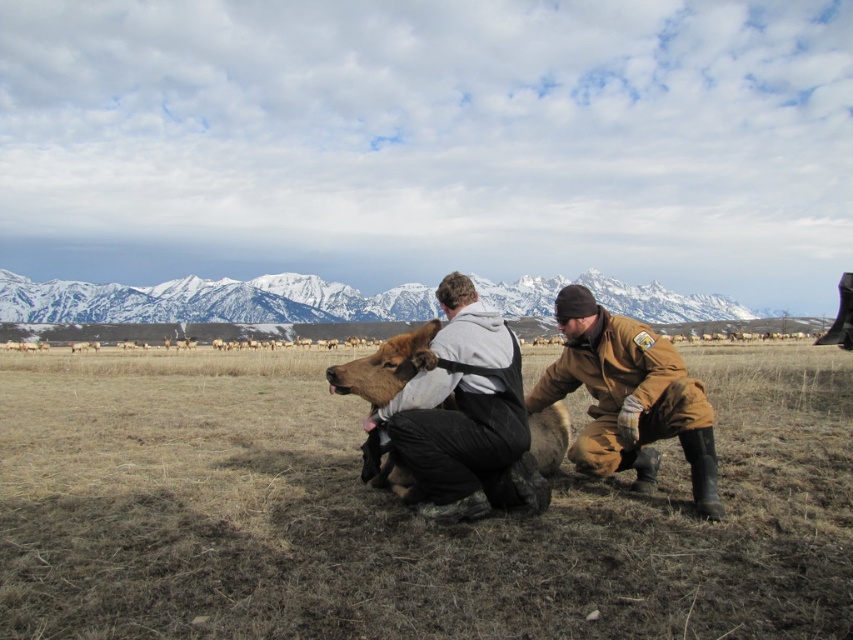
Consider the image. You are a drone operator tasked with capturing aerial footage of the cow in the center of the field. Your drone has a maximum effective range of 10 meters. Based on the scene, will your drone be able to capture clear footage of both the dark brown fur at center and the brown leather jacket at lower right from your current position?

The dark brown fur at center and brown leather jacket at lower right are 10.83 meters apart from each other. Since the drone has a maximum effective range of 10 meters, it cannot capture both objects simultaneously within the same frame due to the distance exceeding the drone camera range.

You are a drone operator tasked with capturing aerial footage of the scene. The two individuals are standing on either side of the brown dry grass at center. How far apart are they?

The two individuals are 42.23 meters apart.

You are a photographer aiming to capture a closeup of the dark brown fur at center and the brown leather jacket at lower right. Since you want both subjects in focus, which one should you focus on first to ensure proper depth of field?

The dark brown fur at center is positioned over brown leather jacket at lower right, so you should focus on the dark brown fur at center first to ensure both are in focus.